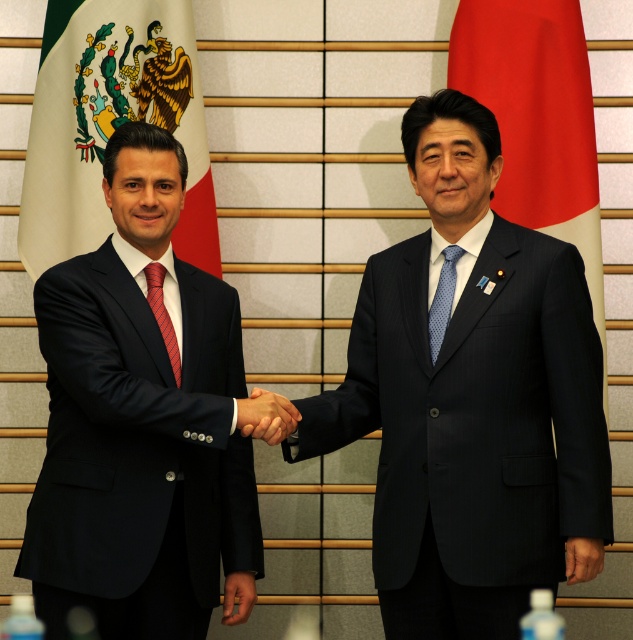
Question: Which object is closer to the camera taking this photo?

Choices:
 (A) matte black hand at center
 (B) red fabric flag at right
 (C) white fabric flag at left
 (D) matte black suit at left

Answer: (D)

Question: Does matte black suit at left appear under matte black hand at center?

Choices:
 (A) yes
 (B) no

Answer: (B)

Question: Is blue dotted tie at center above red silk tie at left?

Choices:
 (A) yes
 (B) no

Answer: (A)

Question: Which point appears farthest from the camera in this image?

Choices:
 (A) (166, 320)
 (B) (522, 125)

Answer: (B)

Question: Among these objects, which one is nearest to the camera?

Choices:
 (A) matte black hand at center
 (B) matte black suit at left
 (C) blue dotted tie at center
 (D) red silk tie at left

Answer: (B)

Question: Does matte black hand at center appear over blue dotted tie at center?

Choices:
 (A) no
 (B) yes

Answer: (A)